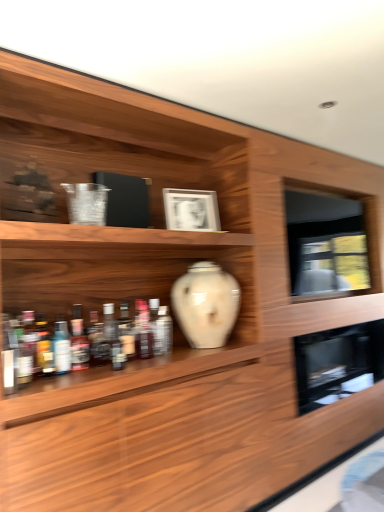
Question: Which is correct: translucent glass bottle at center, which is the sixth bottle from front to back, is inside translucent glass bottle at lower left, which is the 4th bottle from front to back, or outside of it?

Choices:
 (A) outside
 (B) inside

Answer: (A)

Question: Considering the positions of point (130, 334) and point (64, 334), is point (130, 334) closer or farther from the camera than point (64, 334)?

Choices:
 (A) closer
 (B) farther

Answer: (B)

Question: Considering the real-world distances, which object is farthest from the translucent glass bottle at center, which is counted as the 6th bottle, starting from the back?

Choices:
 (A) white matte picture frame at upper center
 (B) translucent glass bottle at lower left, which is the 4th bottle from front to back
 (C) translucent plastic bottle at left, the ninth bottle when ordered from back to front
 (D) translucent glass bottle at left, which is the first bottle from front to back
 (E) translucent glass bottle at left, which appears as the fifth bottle when viewed from the back

Answer: (A)

Question: Based on their relative distances, which object is farther from the translucent glass bottle at lower left, the eighth bottle when ordered from back to front?

Choices:
 (A) translucent glass bottle at center, the second bottle when ordered from back to front
 (B) translucent glass bottle at center, which is the sixth bottle from front to back
 (C) translucent glass bottle at center, which appears as the 1th bottle when viewed from the back
 (D) white matte picture frame at upper center
 (E) white glossy vase at center

Answer: (D)